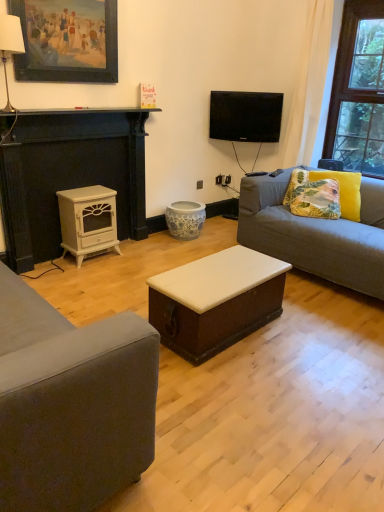
Where is `vacant space underneath white painted wood stove at left, placed as the 2th table when sorted from right to left (from a real-world perspective)`? vacant space underneath white painted wood stove at left, placed as the 2th table when sorted from right to left (from a real-world perspective) is located at coordinates (100, 257).